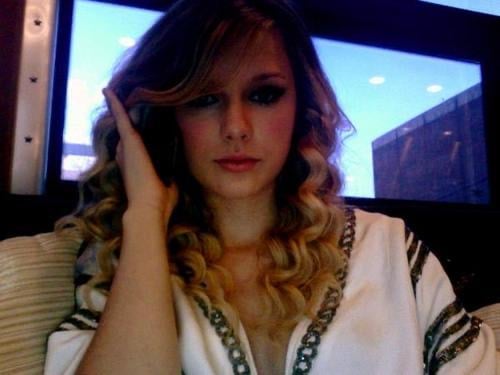
The width and height of the screenshot is (500, 375). Identify the location of window. (387, 133).